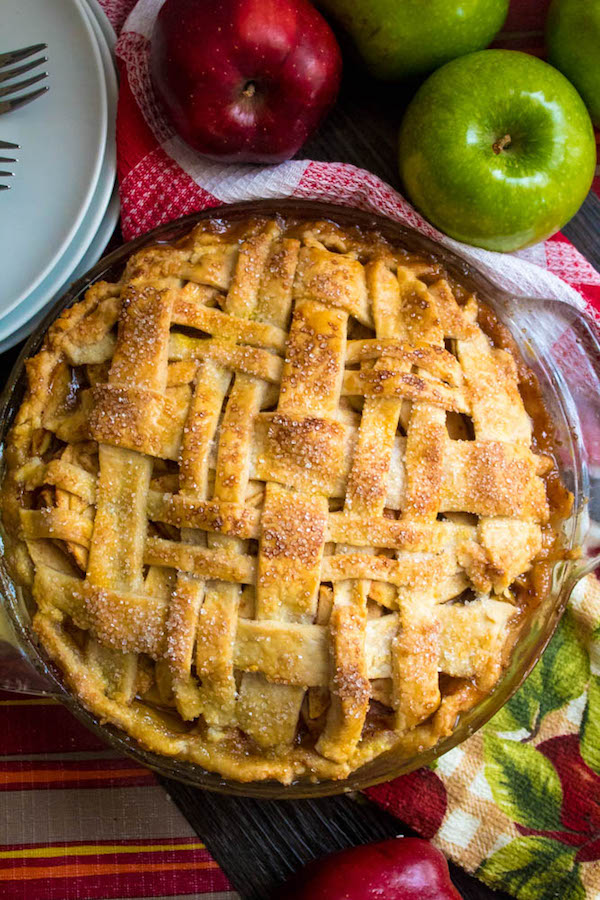
Locate an element on the screen. This screenshot has height=900, width=600. forks is located at coordinates (11, 55), (5, 156).